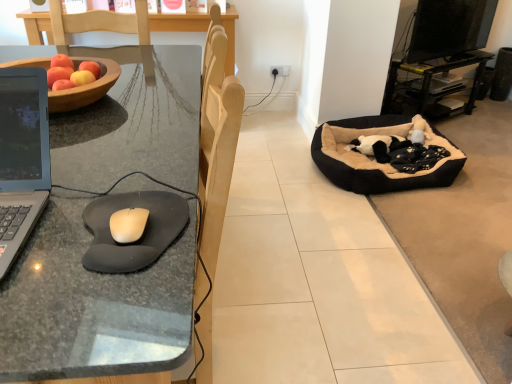
Question: Is black fabric speaker at upper right directly adjacent to wooden bowl at left?

Choices:
 (A) no
 (B) yes

Answer: (A)

Question: Is black fabric speaker at upper right far away from wooden bowl at left?

Choices:
 (A) no
 (B) yes

Answer: (B)

Question: Can you confirm if black fabric speaker at upper right is wider than wooden bowl at left?

Choices:
 (A) no
 (B) yes

Answer: (A)

Question: From the image's perspective, is black fabric speaker at upper right beneath wooden bowl at left?

Choices:
 (A) yes
 (B) no

Answer: (B)

Question: Can you confirm if black fabric speaker at upper right is shorter than wooden bowl at left?

Choices:
 (A) no
 (B) yes

Answer: (A)

Question: Is white matte mouse at left to the left or to the right of black fabric speaker at upper right in the image?

Choices:
 (A) left
 (B) right

Answer: (A)

Question: Would you say white matte mouse at left is inside or outside black fabric speaker at upper right?

Choices:
 (A) outside
 (B) inside

Answer: (A)

Question: Looking at their shapes, would you say white matte mouse at left is wider or thinner than black fabric speaker at upper right?

Choices:
 (A) wide
 (B) thin

Answer: (B)

Question: In terms of height, does white matte mouse at left look taller or shorter compared to black fabric speaker at upper right?

Choices:
 (A) short
 (B) tall

Answer: (A)

Question: Which is correct: black plush dog bed at right is inside black rubber mouse pad at left, or outside of it?

Choices:
 (A) outside
 (B) inside

Answer: (A)

Question: Does point (362, 162) appear closer or farther from the camera than point (129, 339)?

Choices:
 (A) closer
 (B) farther

Answer: (B)

Question: In terms of height, does black plush dog bed at right look taller or shorter compared to black rubber mouse pad at left?

Choices:
 (A) short
 (B) tall

Answer: (A)

Question: From a real-world perspective, is black plush dog bed at right above or below black rubber mouse pad at left?

Choices:
 (A) above
 (B) below

Answer: (B)

Question: Is black plastic entertainment center at right wider or thinner than wooden bowl at left?

Choices:
 (A) wide
 (B) thin

Answer: (B)

Question: Is black plastic entertainment center at right taller or shorter than wooden bowl at left?

Choices:
 (A) short
 (B) tall

Answer: (B)